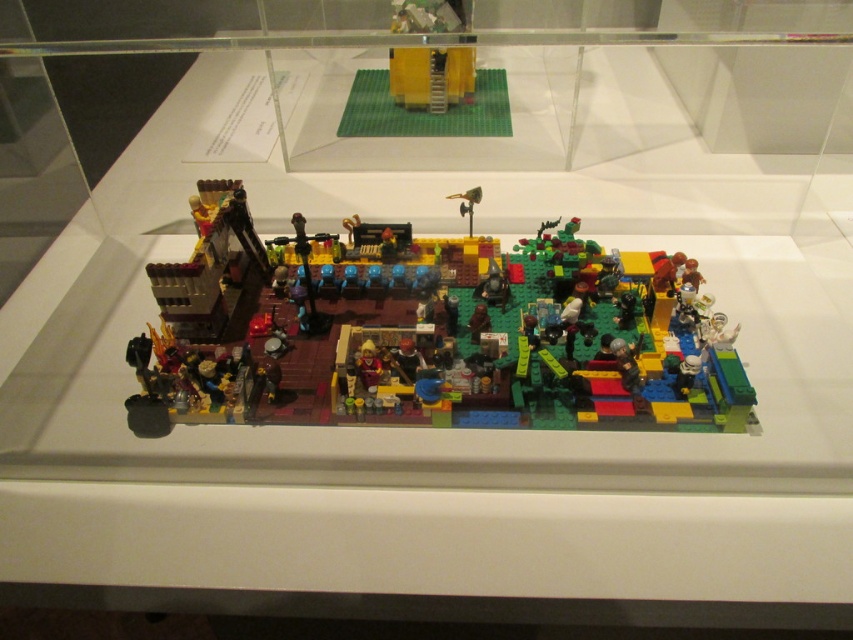
You are a museum visitor standing in front of the LEGO model. You notice a point marked at coordinates (426, 332). What does this point indicate in the LEGO model?

The point at coordinates (426, 332) marks the location of the multicolored plastic LEGO set at center.

You are a visitor standing in front of the LEGO model display. You want to take a photo of the multicolored plastic lego set at center without getting too close. The museum requires visitors to stay at least 4 feet away from the display. Can you take the photo from your current position?

The multicolored plastic lego set at center is 4.13 feet from viewer, so yes, you can take the photo from your current position since you are already 4.13 feet away, which is just beyond the 4 feet requirement.

What are the coordinates of the multicolored plastic lego set at center?

The multicolored plastic lego set at center is located at coordinates point (426, 332).